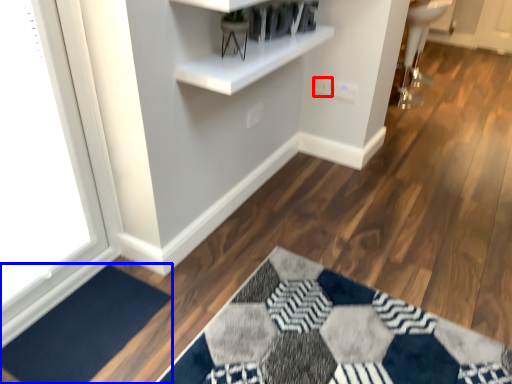
Question: Which object is further to the camera taking this photo, electric outlet (highlighted by a red box) or doormat (highlighted by a blue box)?

Choices:
 (A) electric outlet
 (B) doormat

Answer: (A)